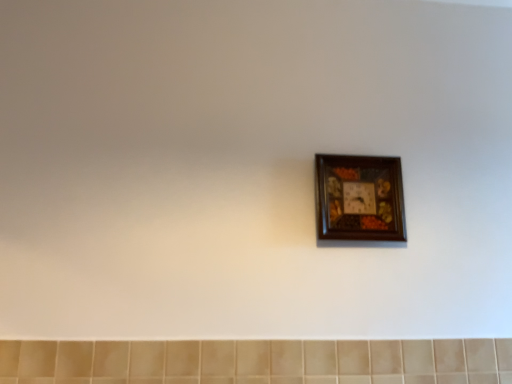
Image resolution: width=512 pixels, height=384 pixels. What do you see at coordinates (257, 361) in the screenshot?
I see `beige ceramic tile at bottom` at bounding box center [257, 361].

Find the location of `beige ceramic tile at bottom`. beige ceramic tile at bottom is located at coordinates (257, 361).

Measure the distance between beige ceramic tile at bottom and camera.

The depth of beige ceramic tile at bottom is 3.95 feet.

Locate an element on the screen. The image size is (512, 384). wooden picture frame at center is located at coordinates (359, 198).

Image resolution: width=512 pixels, height=384 pixels. What do you see at coordinates (359, 198) in the screenshot?
I see `wooden picture frame at center` at bounding box center [359, 198].

The image size is (512, 384). Identify the location of beige ceramic tile at bottom. (257, 361).

Would you say beige ceramic tile at bottom is to the left or to the right of wooden picture frame at center in the picture?

beige ceramic tile at bottom is to the left of wooden picture frame at center.

Which is in front, beige ceramic tile at bottom or wooden picture frame at center?

beige ceramic tile at bottom is closer to the camera.

Between point (39, 354) and point (353, 190), which one is positioned behind?

The point (353, 190) is farther.

From the image's perspective, relative to wooden picture frame at center, is beige ceramic tile at bottom above or below?

beige ceramic tile at bottom is situated lower than wooden picture frame at center in the image.

From a real-world perspective, is beige ceramic tile at bottom on top of wooden picture frame at center?

No, from a real-world perspective, beige ceramic tile at bottom is not over wooden picture frame at center

Considering the sizes of objects beige ceramic tile at bottom and wooden picture frame at center in the image provided, who is wider, beige ceramic tile at bottom or wooden picture frame at center?

wooden picture frame at center is wider.

Does beige ceramic tile at bottom have a greater height compared to wooden picture frame at center?

Incorrect, the height of beige ceramic tile at bottom is not larger of that of wooden picture frame at center.

Considering the relative sizes of beige ceramic tile at bottom and wooden picture frame at center in the image provided, is beige ceramic tile at bottom bigger than wooden picture frame at center?

Correct, beige ceramic tile at bottom is larger in size than wooden picture frame at center.

Is beige ceramic tile at bottom not within wooden picture frame at center?

beige ceramic tile at bottom is positioned outside wooden picture frame at center.

Would you say beige ceramic tile at bottom is a long distance from wooden picture frame at center?

They are positioned close to each other.

Is beige ceramic tile at bottom oriented away from wooden picture frame at center?

No.

The height and width of the screenshot is (384, 512). What are the coordinates of `ceramic tile that is in front of the wooden picture frame at center` in the screenshot? It's located at (257, 361).

Is wooden picture frame at center to the right of beige ceramic tile at bottom from the viewer's perspective?

Correct, you'll find wooden picture frame at center to the right of beige ceramic tile at bottom.

Considering the relative positions of wooden picture frame at center and beige ceramic tile at bottom in the image provided, is wooden picture frame at center in front of beige ceramic tile at bottom?

That is False.

Is point (374, 203) farther from camera compared to point (251, 349)?

That is True.

From the image's perspective, who appears lower, wooden picture frame at center or beige ceramic tile at bottom?

From the image's view, beige ceramic tile at bottom is below.

From a real-world perspective, is wooden picture frame at center physically located above or below beige ceramic tile at bottom?

wooden picture frame at center is situated higher than beige ceramic tile at bottom in the real world.

Considering the relative sizes of wooden picture frame at center and beige ceramic tile at bottom in the image provided, is wooden picture frame at center wider than beige ceramic tile at bottom?

Correct, the width of wooden picture frame at center exceeds that of beige ceramic tile at bottom.

Who is shorter, wooden picture frame at center or beige ceramic tile at bottom?

With less height is beige ceramic tile at bottom.

Does wooden picture frame at center have a larger size compared to beige ceramic tile at bottom?

Incorrect, wooden picture frame at center is not larger than beige ceramic tile at bottom.

Would you say wooden picture frame at center contains beige ceramic tile at bottom?

No, beige ceramic tile at bottom is not a part of wooden picture frame at center.

Consider the image. Are wooden picture frame at center and beige ceramic tile at bottom far apart?

No, wooden picture frame at center is not far from beige ceramic tile at bottom.

Is wooden picture frame at center oriented towards beige ceramic tile at bottom?

No, wooden picture frame at center does not turn towards beige ceramic tile at bottom.

How far apart are wooden picture frame at center and beige ceramic tile at bottom?

They are 18.36 inches apart.

Identify the location of picture frame that appears on the right of beige ceramic tile at bottom. The height and width of the screenshot is (384, 512). (359, 198).

What are the coordinates of `picture frame on the right of beige ceramic tile at bottom` in the screenshot? It's located at (359, 198).

Image resolution: width=512 pixels, height=384 pixels. Identify the location of picture frame above the beige ceramic tile at bottom (from a real-world perspective). (359, 198).